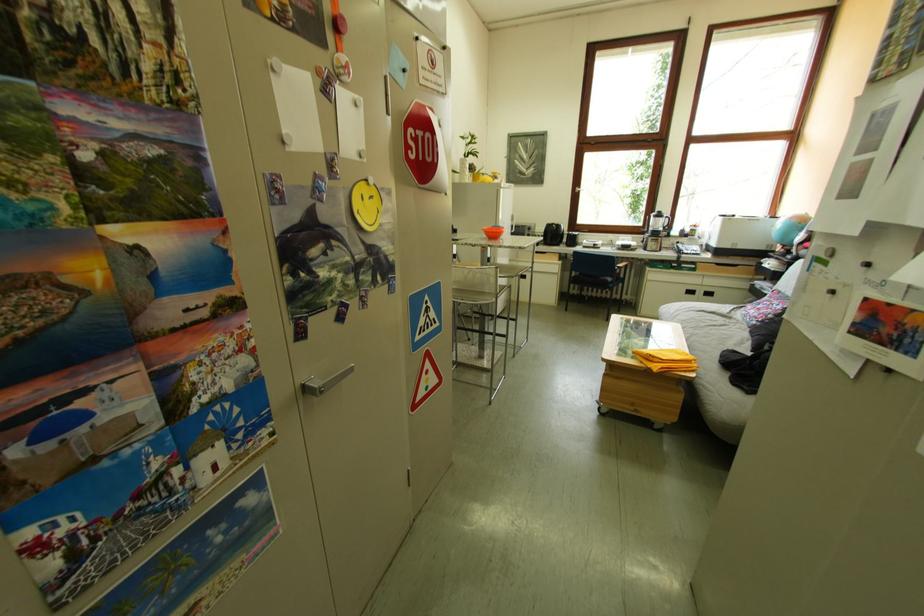
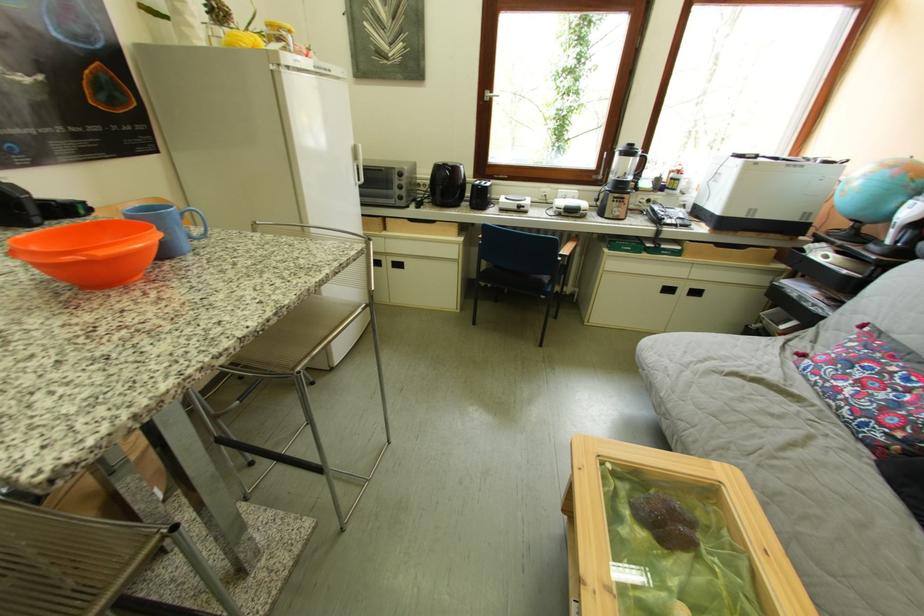
Find the pixel in the second image that matches the point at 562,229 in the first image.

(451, 171)